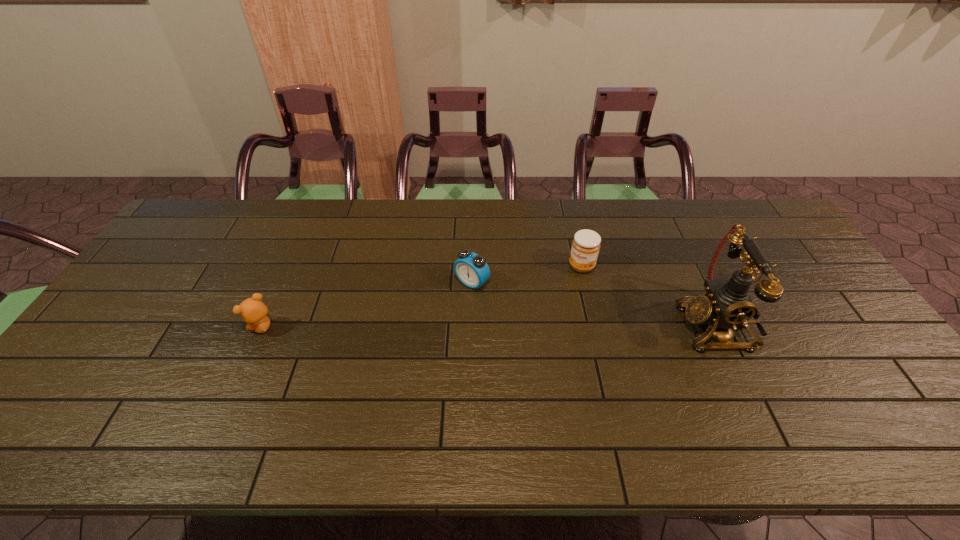
Locate an element on the screen. vacant space on the desktop that is between the leftmost object and the rightmost object and is positioned on the front label of the jam is located at coordinates (537, 326).

Find the location of a particular element. vacant spot on the desktop that is between the teddy bear and the tallest object and is positioned on the face of the second object from left to right is located at coordinates (425, 327).